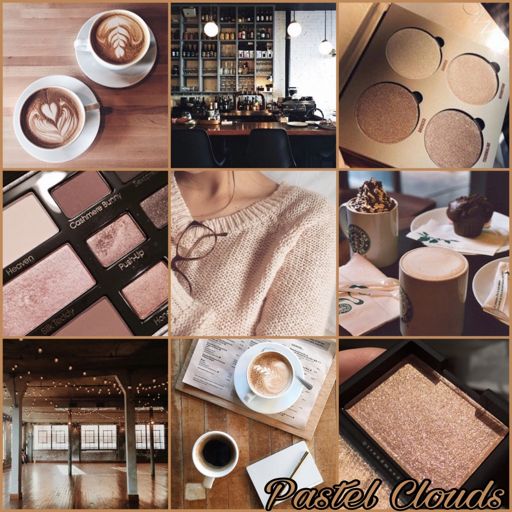
You are a GUI agent. You are given a task and a screenshot of the screen. Output one action in this format:
    pyautogui.click(x=<x>, y=<y>)
    Task: Click on the makeup in palette
    The image size is (512, 512).
    Given the screenshot: What is the action you would take?
    pyautogui.click(x=18, y=218), pyautogui.click(x=90, y=193), pyautogui.click(x=130, y=177), pyautogui.click(x=151, y=205), pyautogui.click(x=116, y=231), pyautogui.click(x=147, y=301), pyautogui.click(x=63, y=282), pyautogui.click(x=100, y=321)